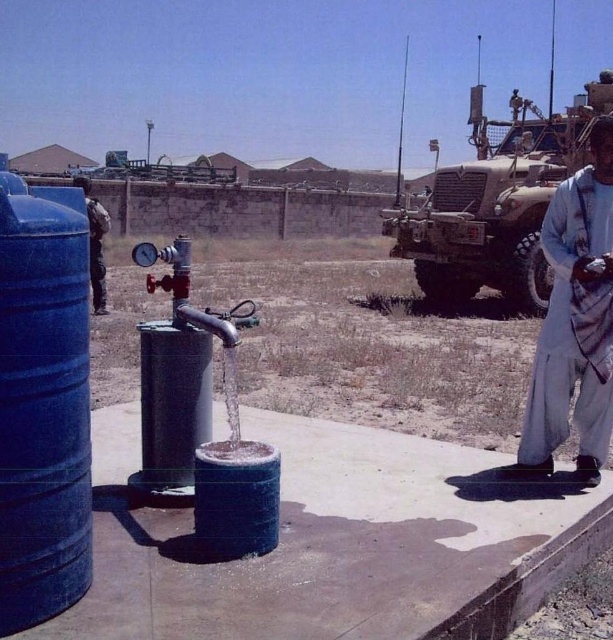
Question: Can you confirm if camouflage fabric military vehicle at upper right is positioned below light gray cotton pants at right?

Choices:
 (A) yes
 (B) no

Answer: (B)

Question: Estimate the real-world distances between objects in this image. Which object is closer to the dark blue fabric jacket at left?

Choices:
 (A) blue matte barrel at left
 (B) light gray cotton pants at right
 (C) camouflage fabric military vehicle at upper right

Answer: (A)

Question: Can you confirm if blue matte barrel at left is positioned above dark blue fabric jacket at left?

Choices:
 (A) yes
 (B) no

Answer: (B)

Question: Among these objects, which one is nearest to the camera?

Choices:
 (A) light gray cotton pants at right
 (B) camouflage fabric military vehicle at upper right
 (C) dark blue fabric jacket at left

Answer: (A)

Question: Does light gray cotton pants at right appear on the left side of dark blue fabric jacket at left?

Choices:
 (A) yes
 (B) no

Answer: (B)

Question: Which of these objects is positioned farthest from the camouflage fabric military vehicle at upper right?

Choices:
 (A) light gray cotton pants at right
 (B) blue matte barrel at left
 (C) dark blue fabric jacket at left

Answer: (A)